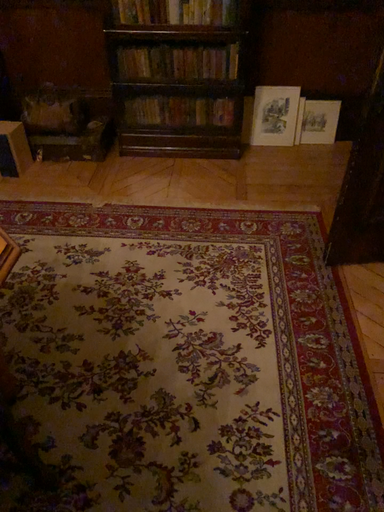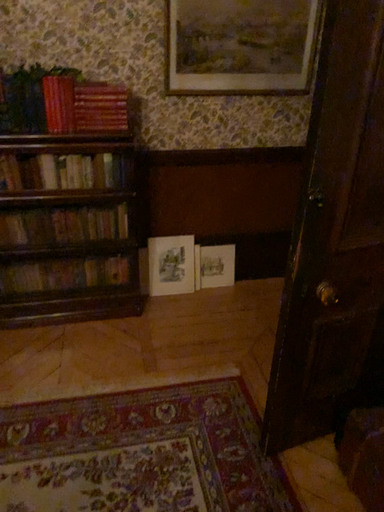
Question: Which way did the camera rotate in the video?

Choices:
 (A) rotated upward
 (B) rotated downward

Answer: (A)